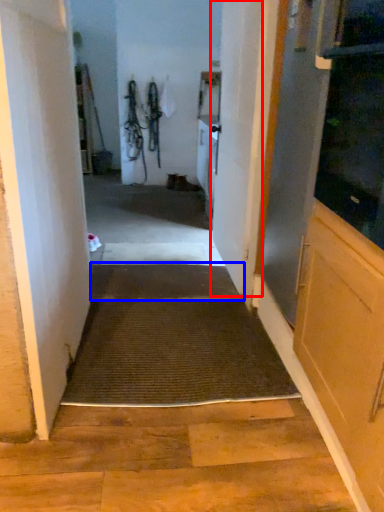
Question: Which of the following is the farthest to the observer, door (highlighted by a red box) or doormat (highlighted by a blue box)?

Choices:
 (A) door
 (B) doormat

Answer: (B)